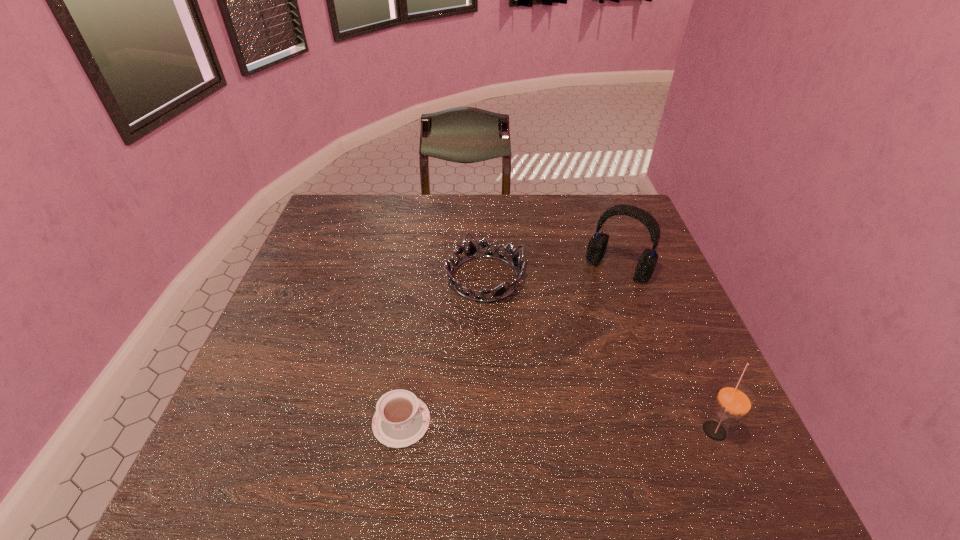
Locate an element on the screen. The image size is (960, 540). teacup is located at coordinates [401, 419].

Find the location of a particular element. Image resolution: width=960 pixels, height=540 pixels. the leftmost object is located at coordinates (401, 419).

Identify the location of straw. (734, 400).

This screenshot has height=540, width=960. In order to click on headset in this screenshot , I will do `click(597, 245)`.

This screenshot has height=540, width=960. I want to click on the third tallest object, so click(471, 251).

You are a GUI agent. You are given a task and a screenshot of the screen. Output one action in this format:
    pyautogui.click(x=<x>, y=<y>)
    Task: Click on the tiara
    The width and height of the screenshot is (960, 540).
    Given the screenshot: What is the action you would take?
    pyautogui.click(x=471, y=251)

Locate an element on the screen. The width and height of the screenshot is (960, 540). vacant space located on the handle side of the leftmost object is located at coordinates (499, 421).

What are the coordinates of `free region located 0.360m on the left of the straw` in the screenshot? It's located at (520, 429).

The width and height of the screenshot is (960, 540). In order to click on vacant space located 0.090m on the headband of the headset in this screenshot , I will do `click(591, 304)`.

Locate an element on the screen. vacant space located on the headband of the headset is located at coordinates (584, 315).